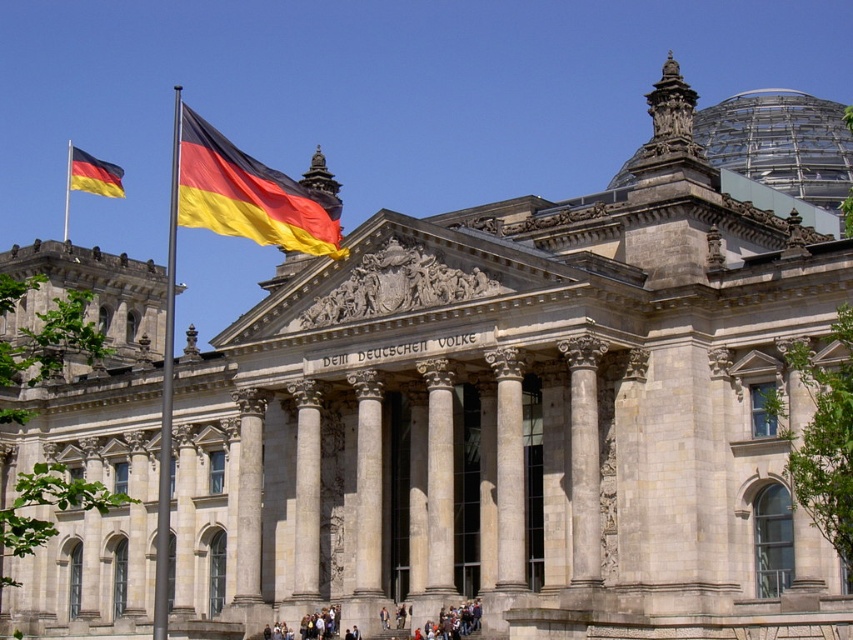
You are a tourist visiting the Reichstag building in Berlin. You notice a flag displayed at point (248, 195). What color are the stripes of the German flag displayed at this point?

The German flag displayed at point (248, 195) has three horizontal stripes of black, red, and gold.